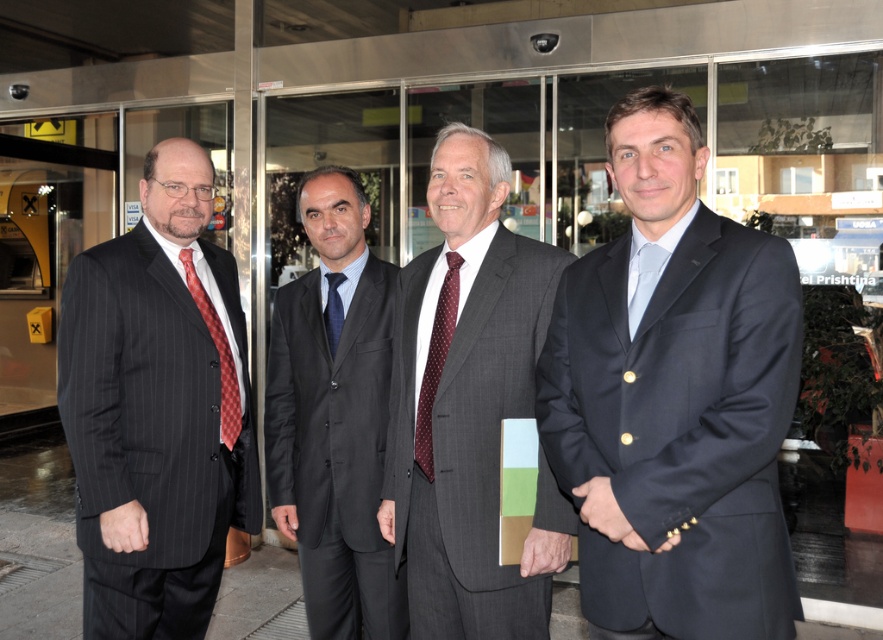
Question: Is maroon dotted silk tie at center positioned before light blue silk tie at right?

Choices:
 (A) yes
 (B) no

Answer: (B)

Question: Which object appears farthest from the camera in this image?

Choices:
 (A) dark blue suit at center
 (B) red checkered tie at left

Answer: (B)

Question: Among these objects, which one is nearest to the camera?

Choices:
 (A) gray pinstripe suit at center
 (B) dark blue suit at center
 (C) red checkered tie at left

Answer: (B)

Question: Does dark blue suit at center appear on the right side of maroon dotted silk tie at center?

Choices:
 (A) yes
 (B) no

Answer: (A)

Question: Considering the relative positions of gray pinstripe suit at center and red checkered tie at left in the image provided, where is gray pinstripe suit at center located with respect to red checkered tie at left?

Choices:
 (A) above
 (B) below

Answer: (B)

Question: Based on their relative distances, which object is farther from the light blue silk tie at right?

Choices:
 (A) dark blue suit at center
 (B) gray pinstripe suit at center
 (C) dark gray suit at center
 (D) maroon dotted silk tie at center

Answer: (C)